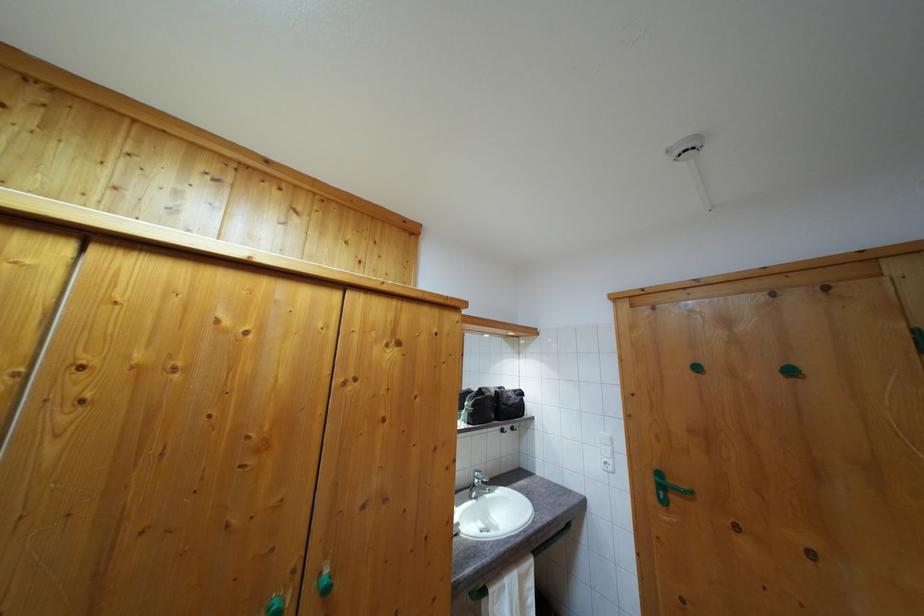
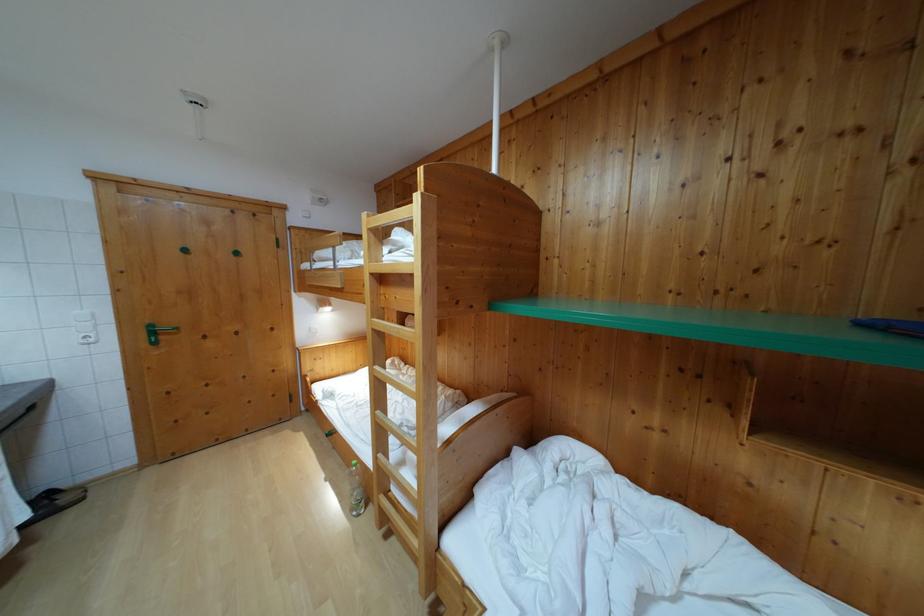
Locate, in the second image, the point that corresponds to (x=662, y=480) in the first image.

(155, 333)